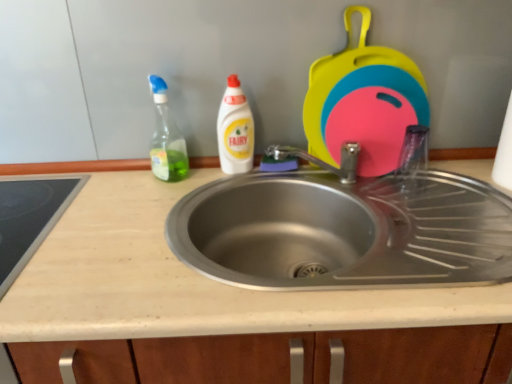
Locate an element on the screen. Image resolution: width=512 pixels, height=384 pixels. unoccupied area in front of translucent plastic spray bottle at left, the second cleaning product from the right is located at coordinates (150, 203).